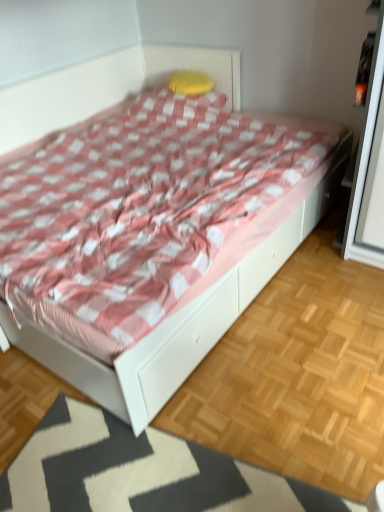
What are the coordinates of `vacant point above white textured mat at lower center (from a real-world perspective)` in the screenshot? It's located at (157, 470).